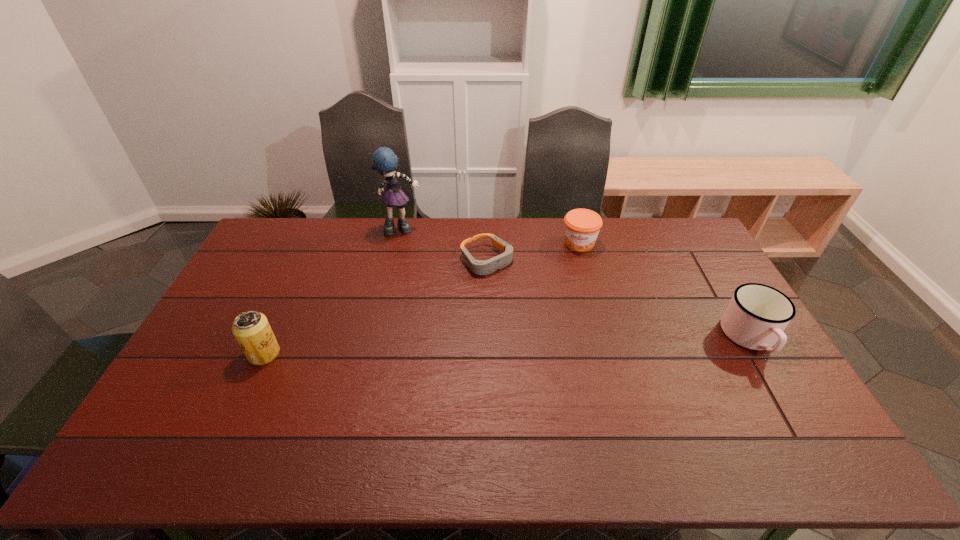
Where is `free space on the desktop that is between the beer can and the mug and is positioned on the front and back of the third object from right to left`? The image size is (960, 540). free space on the desktop that is between the beer can and the mug and is positioned on the front and back of the third object from right to left is located at coordinates (577, 343).

At what (x,y) coordinates should I click in order to perform the action: click on vacant space on the desktop that is between the beer can and the rightmost object and is positioned on the front-facing side of the tallest object. Please return your answer as a coordinate pair (x, y). Looking at the image, I should click on (457, 347).

Locate an element on the screen. vacant space on the desktop that is between the leftmost object and the rightmost object and is positioned on the front label of the fourth object from left to right is located at coordinates (562, 344).